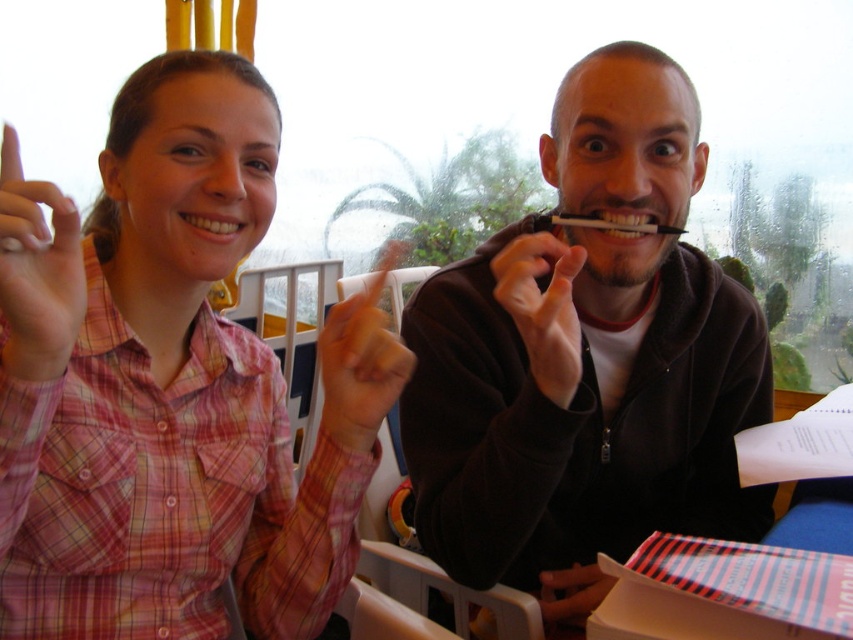
Question: Estimate the real-world distances between objects in this image. Which object is closer to the pink plaid shirt at upper left?

Choices:
 (A) plaid shirt at center
 (B) white glossy teeth at upper center
 (C) black matte hand at center
 (D) white glossy teeth at center

Answer: (A)

Question: Is pink plaid shirt at upper left above white glossy teeth at upper center?

Choices:
 (A) yes
 (B) no

Answer: (B)

Question: Which point is closer to the camera taking this photo?

Choices:
 (A) (216, 218)
 (B) (393, 355)

Answer: (B)

Question: Is plaid shirt at center bigger than orange matte finger at center?

Choices:
 (A) no
 (B) yes

Answer: (B)

Question: Which object is farther from the camera taking this photo?

Choices:
 (A) black matte hand at center
 (B) plaid shirt at center
 (C) black matte pen at center
 (D) orange matte finger at center

Answer: (C)

Question: Is plaid shirt at center above white glossy teeth at center?

Choices:
 (A) yes
 (B) no

Answer: (B)